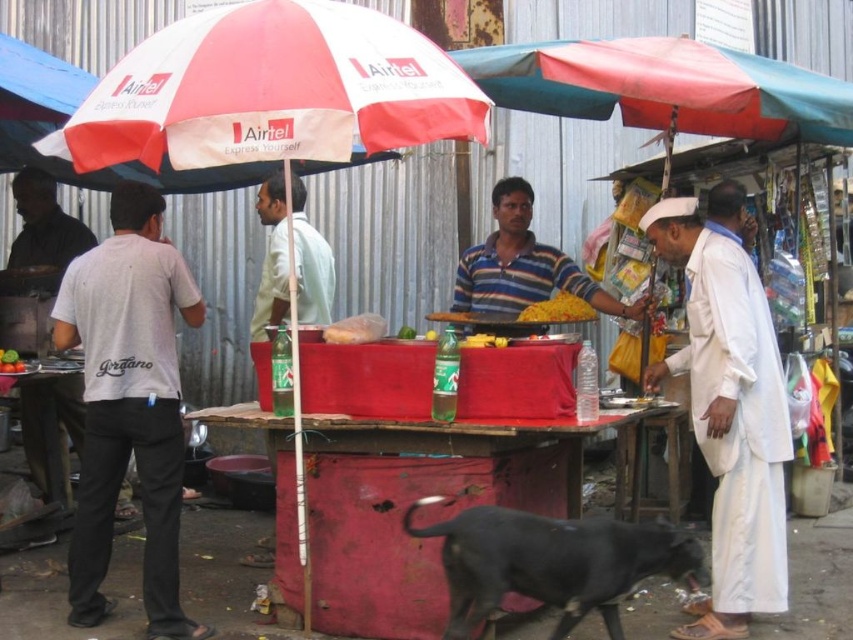
Question: Is striped cotton shirt at center below yellow matte corn at center?

Choices:
 (A) no
 (B) yes

Answer: (A)

Question: Which object is the closest to the yellow matte food at center?

Choices:
 (A) white cotton t-shirt at left
 (B) white cotton shirt at center
 (C) green matte cucumber at center

Answer: (B)

Question: Does white cotton t-shirt at left have a larger size compared to striped cotton shirt at center?

Choices:
 (A) no
 (B) yes

Answer: (B)

Question: Which of the following is the farthest from the observer?

Choices:
 (A) yellow matte food at center
 (B) white cotton shirt at center

Answer: (B)

Question: Does white cotton shirt at center appear over green matte cucumber at center?

Choices:
 (A) yes
 (B) no

Answer: (B)

Question: Which of the following is the farthest from the observer?

Choices:
 (A) yellow matte food at center
 (B) green matte cucumber at center
 (C) striped cotton shirt at center
 (D) white cotton t-shirt at left

Answer: (C)